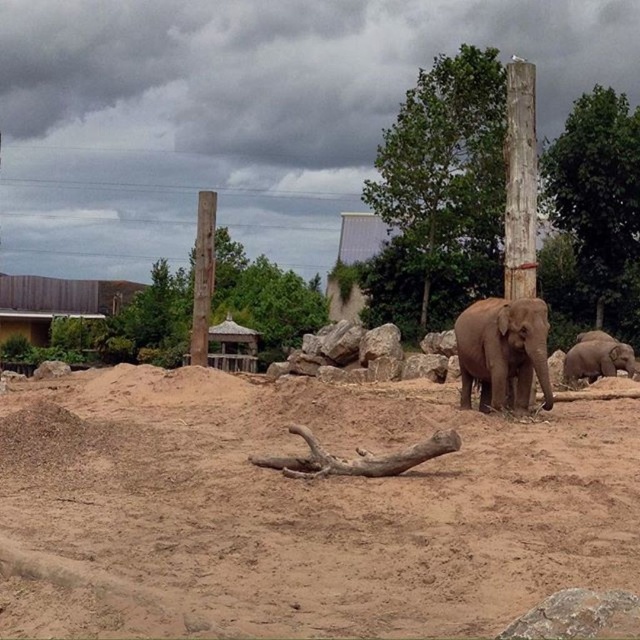
Does green leafy tree at upper right appear under brown wood pole at left?

Actually, green leafy tree at upper right is above brown wood pole at left.

Can you confirm if green leafy tree at upper right is positioned above brown wood pole at left?

Yes, green leafy tree at upper right is above brown wood pole at left.

Which is in front, point (584, 320) or point (202, 264)?

Positioned in front is point (202, 264).

The image size is (640, 640). Identify the location of green leafy tree at upper right. (593, 214).

What do you see at coordinates (518, 180) in the screenshot? Image resolution: width=640 pixels, height=640 pixels. I see `weathered wood pole at right` at bounding box center [518, 180].

Does weathered wood pole at right have a greater height compared to brown wood pole at left?

Yes, weathered wood pole at right is taller than brown wood pole at left.

Measure the distance between weathered wood pole at right and camera.

The distance of weathered wood pole at right from camera is 43.34 feet.

I want to click on weathered wood pole at right, so click(518, 180).

Is green leafy tree at center to the left of gray matte elephant at center from the viewer's perspective?

Indeed, green leafy tree at center is positioned on the left side of gray matte elephant at center.

Which is in front, point (134, 307) or point (506, 387)?

Positioned in front is point (506, 387).

Locate an element on the screen. green leafy tree at center is located at coordinates (262, 296).